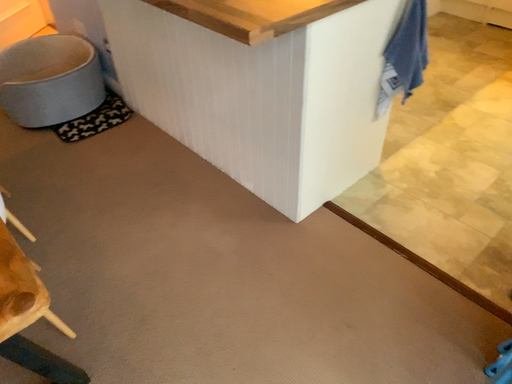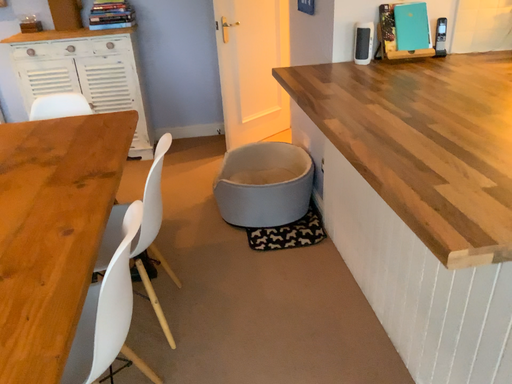
Question: How did the camera likely rotate when shooting the video?

Choices:
 (A) rotated upward
 (B) rotated downward

Answer: (A)